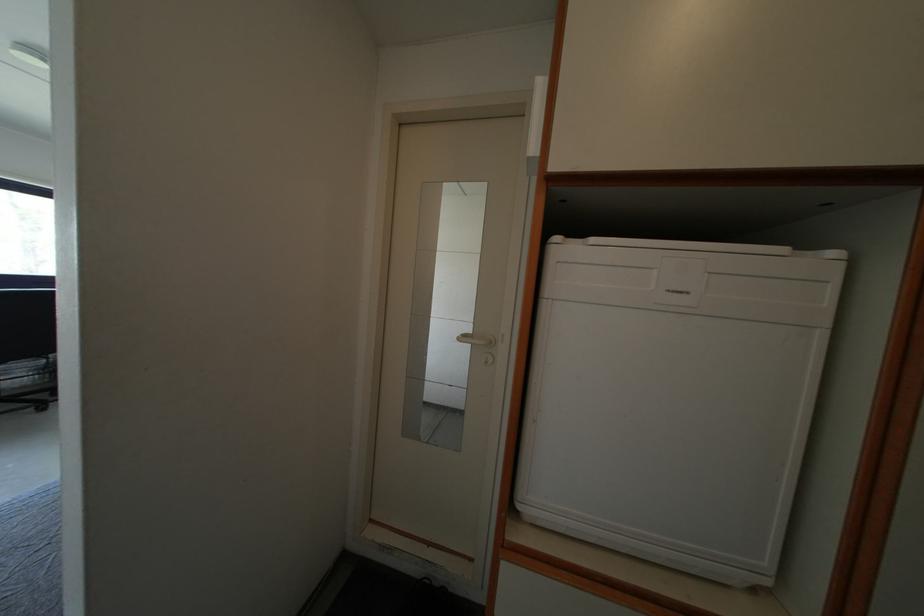
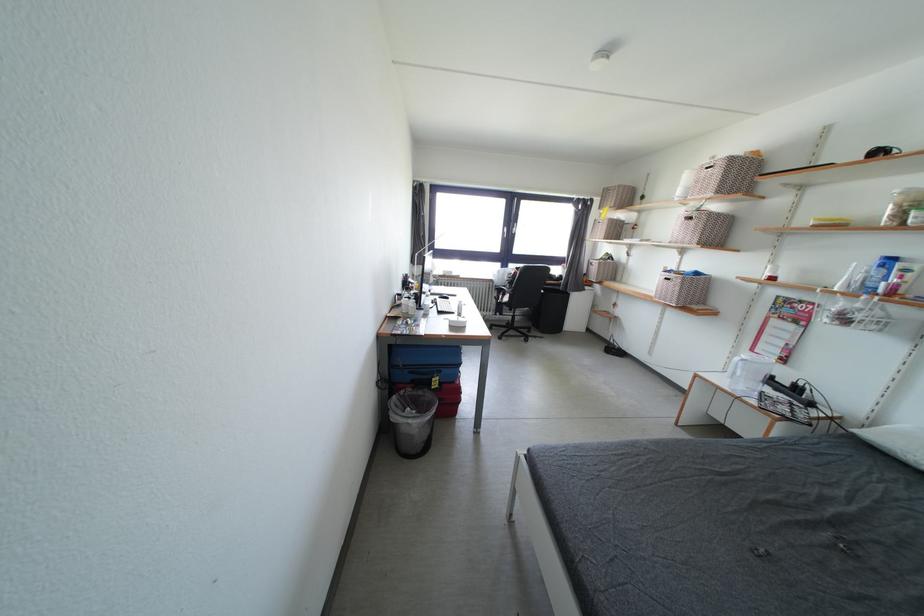
Question: How did the camera likely rotate?

Choices:
 (A) Left
 (B) Right
 (C) Up
 (D) Down

Answer: (A)